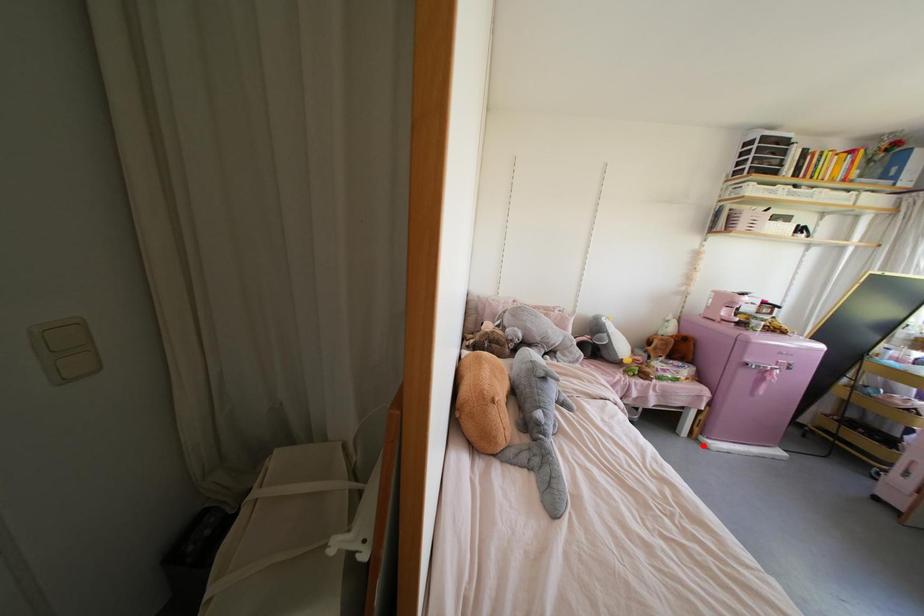
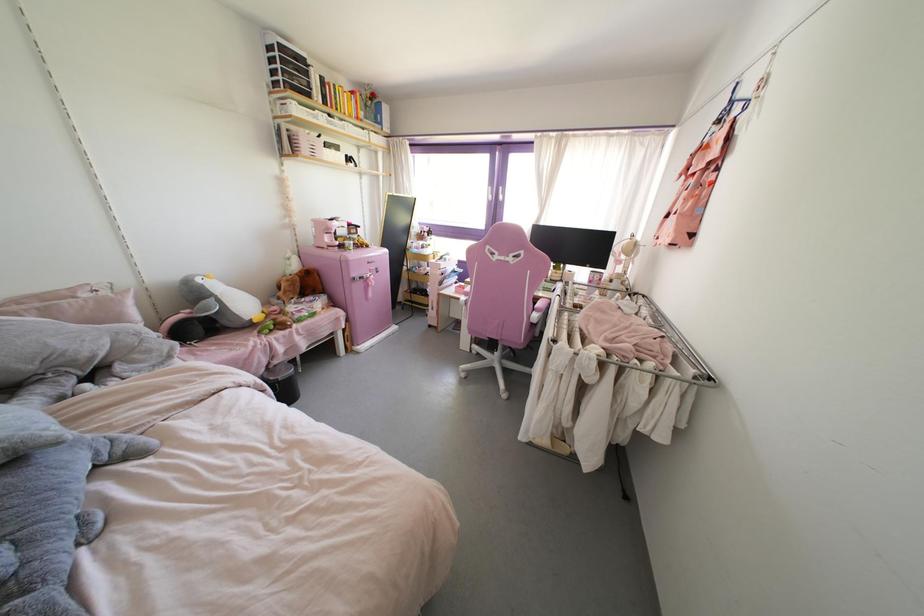
Question: I am providing you with two images of the same scene from different viewpoints. A red point is marked on the first image. Can you still see the location of the red point in image 2?

Choices:
 (A) Yes
 (B) No

Answer: (A)